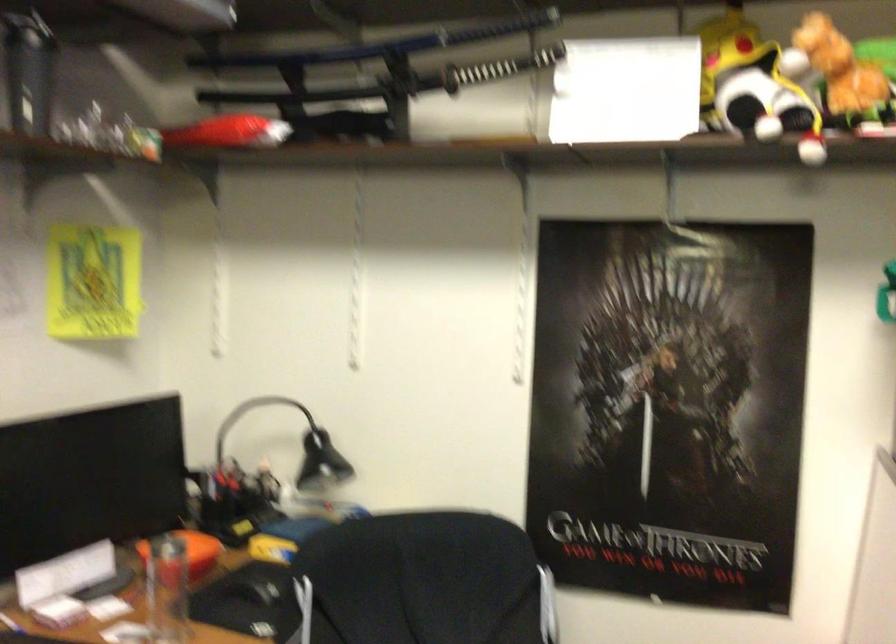
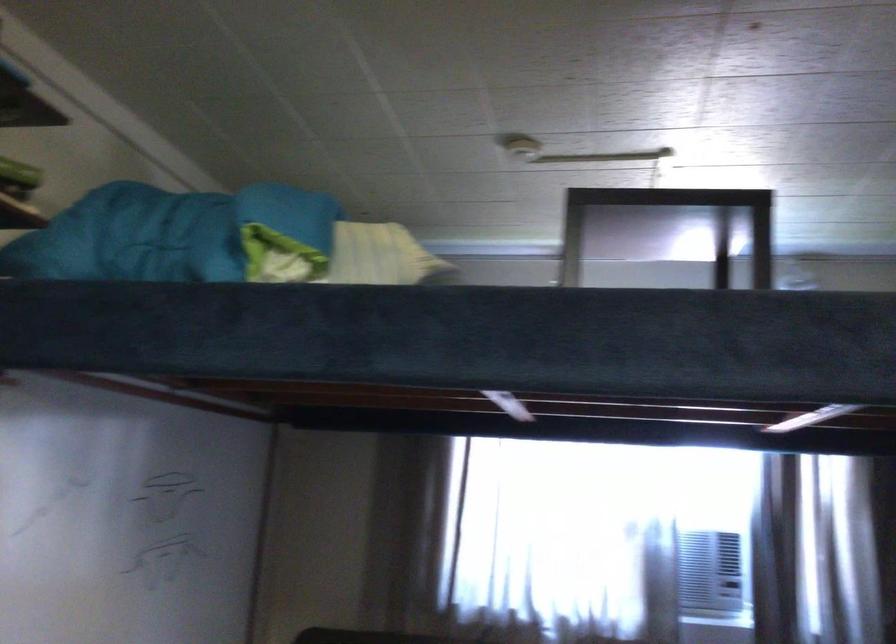
Question: The images are taken continuously from a first-person perspective. In which direction is your viewpoint rotating?

Choices:
 (A) Left
 (B) Right
 (C) Up
 (D) Down

Answer: (B)